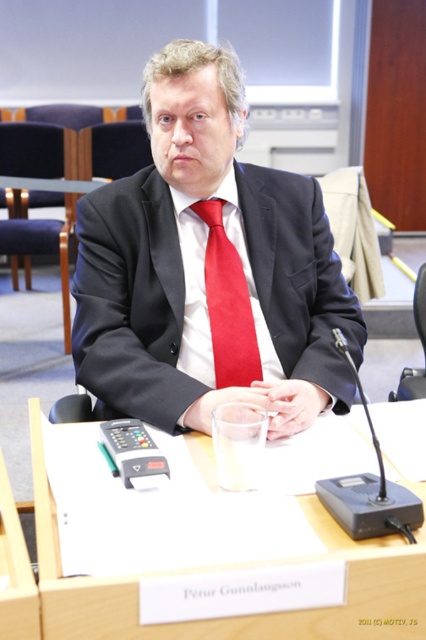
Who is lower down, red satin tie at center or clear glass table at center?

Positioned lower is red satin tie at center.

Between point (247, 304) and point (22, 182), which one is positioned in front?

Point (247, 304) is in front.

Is point (215, 228) in front of point (31, 177)?

Yes, point (215, 228) is in front of point (31, 177).

Identify the location of red satin tie at center. (227, 304).

Locate an element on the screen. The width and height of the screenshot is (426, 640). matte black suit at center is located at coordinates (209, 268).

Is point (111, 202) less distant than point (210, 630)?

That is False.

This screenshot has height=640, width=426. Identify the location of matte black suit at center. (209, 268).

Between white paper at center and clear glass table at center, which one appears on the right side from the viewer's perspective?

Positioned to the right is white paper at center.

Does point (290, 618) come in front of point (34, 188)?

Yes, point (290, 618) is closer to viewer.

Image resolution: width=426 pixels, height=640 pixels. I want to click on white paper at center, so click(244, 616).